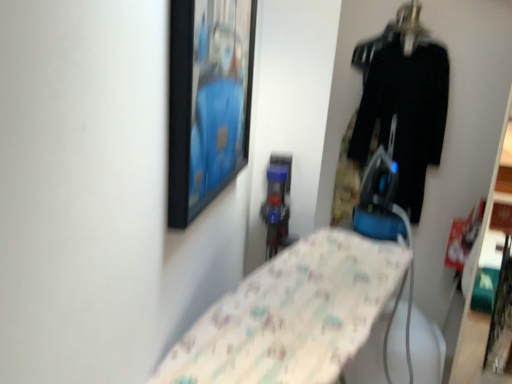
Question: From a real-world perspective, is black fabric pants at right located beneath metallic hanger at upper right?

Choices:
 (A) no
 (B) yes

Answer: (B)

Question: Is black fabric pants at right aimed at metallic hanger at upper right?

Choices:
 (A) yes
 (B) no

Answer: (B)

Question: Considering the relative sizes of black fabric pants at right and metallic hanger at upper right in the image provided, is black fabric pants at right taller than metallic hanger at upper right?

Choices:
 (A) yes
 (B) no

Answer: (A)

Question: Is the position of black fabric pants at right less distant than that of metallic hanger at upper right?

Choices:
 (A) yes
 (B) no

Answer: (B)

Question: From the image's perspective, is black fabric pants at right below metallic hanger at upper right?

Choices:
 (A) yes
 (B) no

Answer: (A)

Question: Considering the positions of metallic hanger at upper right and black fabric pants at right in the image, is metallic hanger at upper right bigger or smaller than black fabric pants at right?

Choices:
 (A) big
 (B) small

Answer: (B)

Question: Is metallic hanger at upper right to the left or to the right of black fabric pants at right in the image?

Choices:
 (A) right
 (B) left

Answer: (B)

Question: In the image, is metallic hanger at upper right positioned in front of or behind black fabric pants at right?

Choices:
 (A) behind
 (B) front

Answer: (B)

Question: Considering the positions of metallic hanger at upper right and black fabric pants at right in the image, is metallic hanger at upper right taller or shorter than black fabric pants at right?

Choices:
 (A) tall
 (B) short

Answer: (B)

Question: Is point (227, 39) closer or farther from the camera than point (425, 71)?

Choices:
 (A) closer
 (B) farther

Answer: (A)

Question: Relative to black fabric pants at right, is black matte picture frame at upper center in front or behind?

Choices:
 (A) behind
 (B) front

Answer: (B)

Question: In terms of height, does black matte picture frame at upper center look taller or shorter compared to black fabric pants at right?

Choices:
 (A) short
 (B) tall

Answer: (A)

Question: Looking at their shapes, would you say black matte picture frame at upper center is wider or thinner than black fabric pants at right?

Choices:
 (A) thin
 (B) wide

Answer: (A)

Question: Does point (375, 107) appear closer or farther from the camera than point (236, 66)?

Choices:
 (A) closer
 (B) farther

Answer: (B)

Question: From a real-world perspective, is black fabric pants at right above or below black matte picture frame at upper center?

Choices:
 (A) below
 (B) above

Answer: (A)